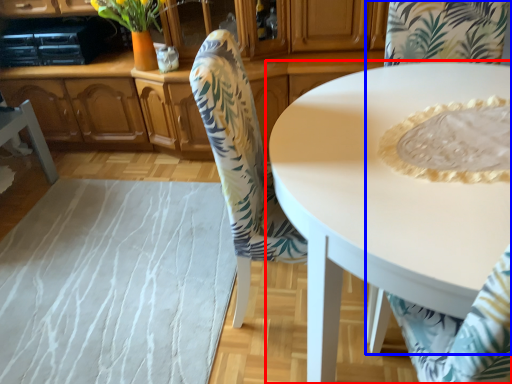
Question: Which point is closer to the camera, coffee table (highlighted by a red box) or chair (highlighted by a blue box)?

Choices:
 (A) coffee table
 (B) chair

Answer: (B)